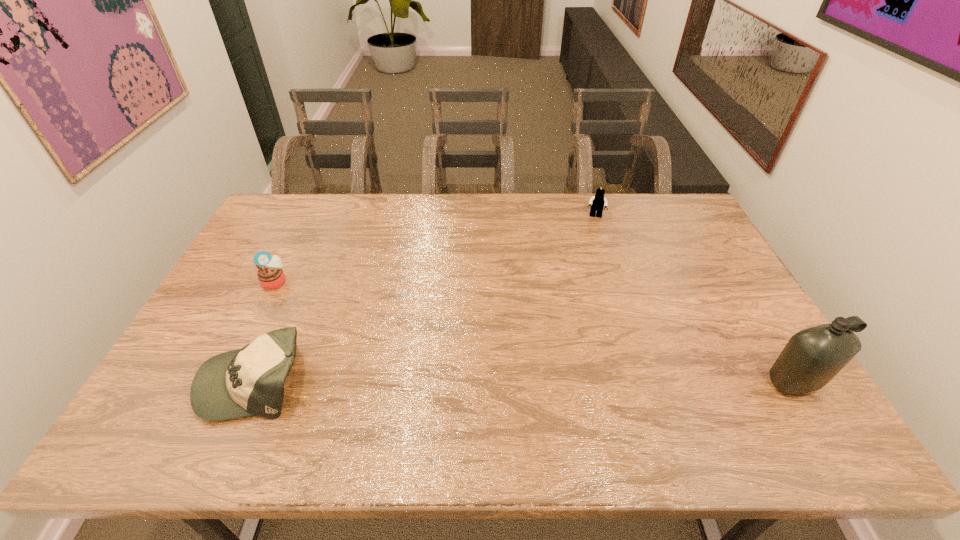
Where is `object positioned at the near left corner`? Image resolution: width=960 pixels, height=540 pixels. object positioned at the near left corner is located at coordinates (244, 382).

Locate an element on the screen. Image resolution: width=960 pixels, height=540 pixels. object that is at the near right corner is located at coordinates (812, 357).

Identify the location of vacant space at the far edge. The height and width of the screenshot is (540, 960). (553, 196).

Find the location of a particular element. This screenshot has width=960, height=540. free space at the near edge is located at coordinates (602, 395).

At what (x,y) coordinates should I click in order to perform the action: click on free location at the left edge of the desktop. Please return your answer as a coordinate pair (x, y). The image size is (960, 540). Looking at the image, I should click on (252, 239).

You are a GUI agent. You are given a task and a screenshot of the screen. Output one action in this format:
    pyautogui.click(x=<x>, y=<y>)
    Task: Click on the free point at the right edge
    The image size is (960, 540).
    Given the screenshot: What is the action you would take?
    pyautogui.click(x=736, y=329)

The height and width of the screenshot is (540, 960). Find the location of `vacant space at the far right corner of the desktop`. vacant space at the far right corner of the desktop is located at coordinates (650, 217).

You are a GUI agent. You are given a task and a screenshot of the screen. Output one action in this format:
    pyautogui.click(x=<x>, y=<y>)
    Task: Click on the free spot between the second object from right to left and the rightmost object
    The width and height of the screenshot is (960, 540).
    Given the screenshot: What is the action you would take?
    pyautogui.click(x=695, y=299)

I want to click on empty location between the second farthest object and the baseball cap, so click(265, 330).

Locate an element on the screen. The height and width of the screenshot is (540, 960). vacant region between the rightmost object and the baseball cap is located at coordinates (525, 381).